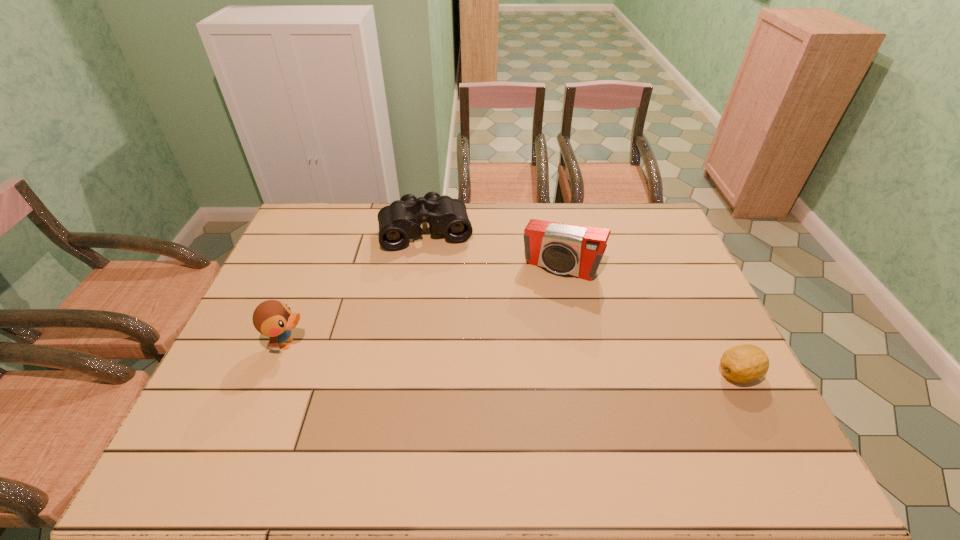
You are a GUI agent. You are given a task and a screenshot of the screen. Output one action in this format:
    pyautogui.click(x=<x>, y=<y>)
    Task: Click on the leftmost object
    Image resolution: width=960 pixels, height=540 pixels.
    Given the screenshot: What is the action you would take?
    pyautogui.click(x=272, y=318)

The image size is (960, 540). What are the coordinates of `duck` in the screenshot? It's located at (272, 318).

This screenshot has height=540, width=960. In order to click on lemon in this screenshot , I will do `click(745, 363)`.

Identify the location of the nearest object. (745, 363).

Locate an element on the screen. camera is located at coordinates (566, 249).

You are a GUI agent. You are given a task and a screenshot of the screen. Output one action in this format:
    pyautogui.click(x=<x>, y=<y>)
    Task: Click on the second object from left to right
    Image resolution: width=960 pixels, height=540 pixels.
    Given the screenshot: What is the action you would take?
    pyautogui.click(x=401, y=220)

Find the location of a particular element. This screenshot has height=540, width=960. the second shortest object is located at coordinates (401, 220).

You are a GUI agent. You are given a task and a screenshot of the screen. Output one action in this format:
    pyautogui.click(x=<x>, y=<y>)
    Task: Click on the blank space located 0.140m on the front-facing side of the leftmost object
    The height and width of the screenshot is (540, 960).
    Given the screenshot: What is the action you would take?
    pyautogui.click(x=361, y=343)

At what (x,y) coordinates should I click in order to perform the action: click on vacant space located 0.170m at the stem end of the nearest object. Please return your answer as a coordinate pair (x, y). This screenshot has height=540, width=960. Looking at the image, I should click on (648, 374).

In order to click on vacant space located 0.170m at the stem end of the nearest object in this screenshot , I will do `click(648, 374)`.